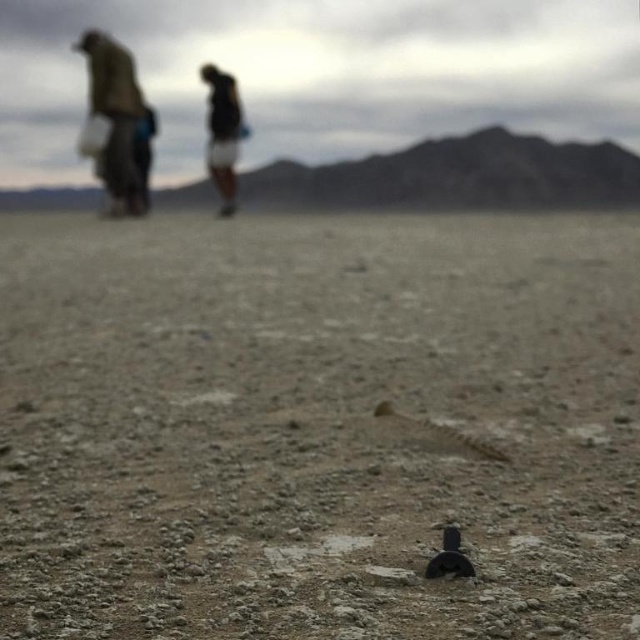
Question: Is dull brown dirt at center thinner than brown fabric jacket at upper left?

Choices:
 (A) yes
 (B) no

Answer: (A)

Question: Which of the following is the farthest from the observer?

Choices:
 (A) dull brown dirt at center
 (B) dark brown leather jacket at upper center
 (C) dark brown fabric at upper left

Answer: (B)

Question: Which point appears closest to the camera in this image?

Choices:
 (A) (92, 83)
 (B) (211, 83)
 (C) (236, 152)
 (D) (387, 600)

Answer: (D)

Question: Does dark brown fabric at upper left appear under dark brown leather jacket at upper center?

Choices:
 (A) yes
 (B) no

Answer: (B)

Question: Which object appears closest to the camera in this image?

Choices:
 (A) dark brown leather jacket at upper center
 (B) dark brown fabric at upper left
 (C) dull brown dirt at center

Answer: (C)

Question: Can you confirm if dull brown dirt at center is smaller than dark brown leather jacket at upper center?

Choices:
 (A) yes
 (B) no

Answer: (A)